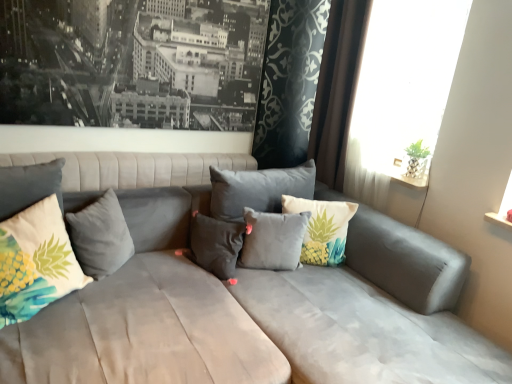
Question: Which direction should I rotate to face pineapple-patterned fabric pillow at center, placed as the 1th pillow when sorted from right to left, — up or down?

Choices:
 (A) up
 (B) down

Answer: (B)

Question: Would you say suede gray couch at center is a long distance from pineapple-patterned fabric pillow at center, which is counted as the 5th pillow, starting from the left?

Choices:
 (A) no
 (B) yes

Answer: (A)

Question: Considering the relative sizes of suede gray couch at center and pineapple-patterned fabric pillow at center, placed as the 1th pillow when sorted from right to left, in the image provided, is suede gray couch at center shorter than pineapple-patterned fabric pillow at center, placed as the 1th pillow when sorted from right to left,?

Choices:
 (A) yes
 (B) no

Answer: (B)

Question: Does suede gray couch at center have a lesser width compared to pineapple-patterned fabric pillow at center, placed as the 1th pillow when sorted from right to left?

Choices:
 (A) no
 (B) yes

Answer: (A)

Question: Is suede gray couch at center positioned behind pineapple-patterned fabric pillow at center, placed as the 1th pillow when sorted from right to left?

Choices:
 (A) yes
 (B) no

Answer: (B)

Question: From a real-world perspective, is suede gray couch at center beneath pineapple-patterned fabric pillow at center, which is counted as the 5th pillow, starting from the left?

Choices:
 (A) no
 (B) yes

Answer: (B)

Question: Does suede gray couch at center appear on the right side of pineapple-patterned fabric pillow at center, placed as the 1th pillow when sorted from right to left?

Choices:
 (A) no
 (B) yes

Answer: (A)

Question: Does white sheer curtain at upper right appear on the left side of black matte picture frame at upper left?

Choices:
 (A) no
 (B) yes

Answer: (A)

Question: Is white sheer curtain at upper right surrounding black matte picture frame at upper left?

Choices:
 (A) yes
 (B) no

Answer: (B)

Question: Considering the relative sizes of white sheer curtain at upper right and black matte picture frame at upper left in the image provided, is white sheer curtain at upper right smaller than black matte picture frame at upper left?

Choices:
 (A) no
 (B) yes

Answer: (A)

Question: Is white sheer curtain at upper right turned away from black matte picture frame at upper left?

Choices:
 (A) yes
 (B) no

Answer: (B)

Question: Can you confirm if white sheer curtain at upper right is taller than black matte picture frame at upper left?

Choices:
 (A) no
 (B) yes

Answer: (B)

Question: From a real-world perspective, is white sheer curtain at upper right on top of black matte picture frame at upper left?

Choices:
 (A) yes
 (B) no

Answer: (B)

Question: Can you confirm if white sheer curtain at upper right is shorter than gray velvet pillow at center, positioned as the second pillow in left-to-right order?

Choices:
 (A) yes
 (B) no

Answer: (B)